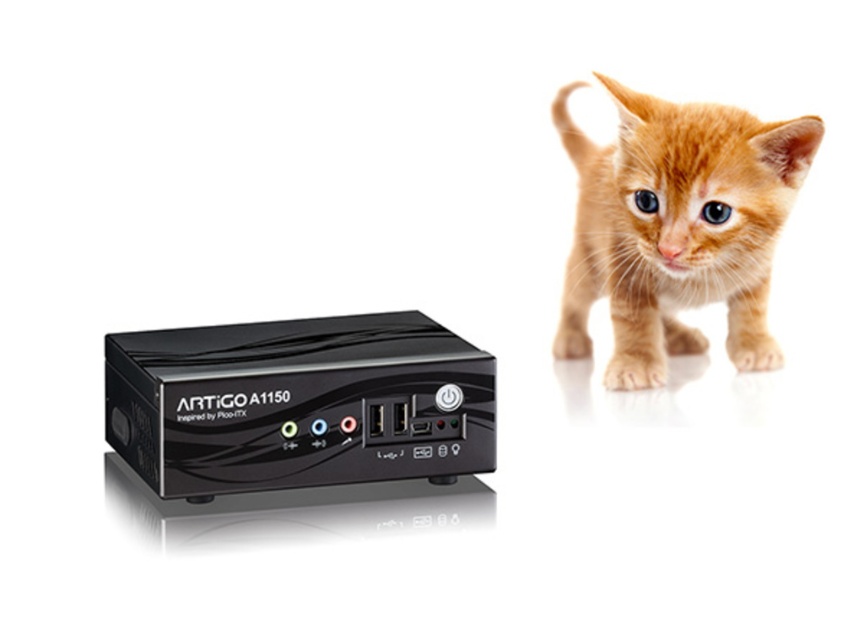
Does black plastic artigo a1150 at left have a lesser width compared to orange fur kitten at upper right?

In fact, black plastic artigo a1150 at left might be wider than orange fur kitten at upper right.

Which of these two, black plastic artigo a1150 at left or orange fur kitten at upper right, stands shorter?

Standing shorter between the two is black plastic artigo a1150 at left.

The image size is (864, 640). I want to click on black plastic artigo a1150 at left, so click(297, 403).